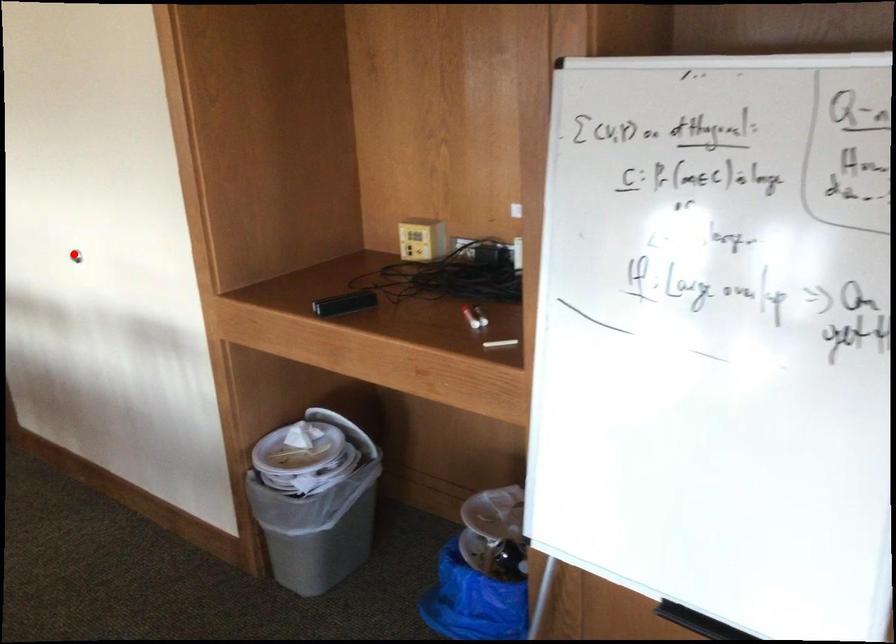
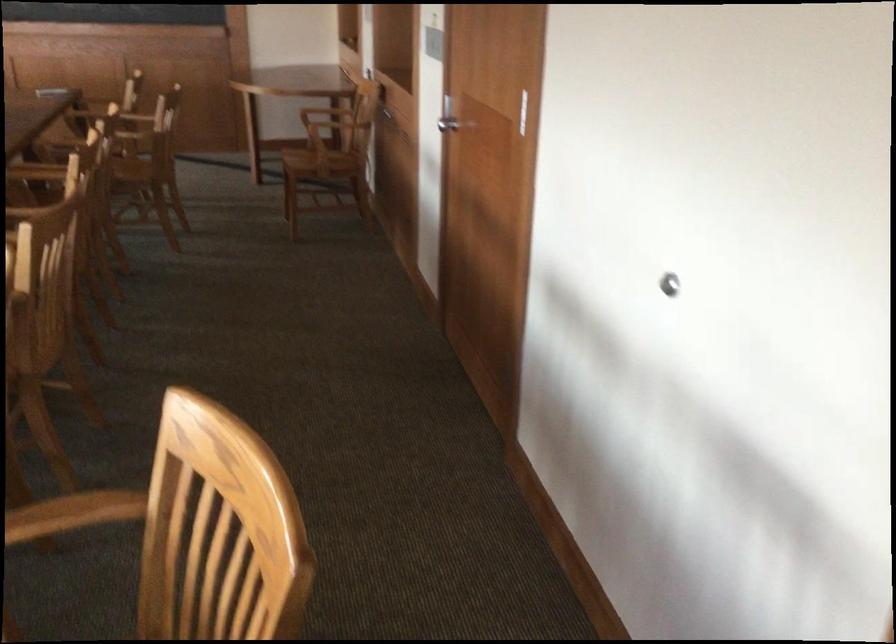
Find the pixel in the second image that matches the highlighted location in the first image.

(669, 283)